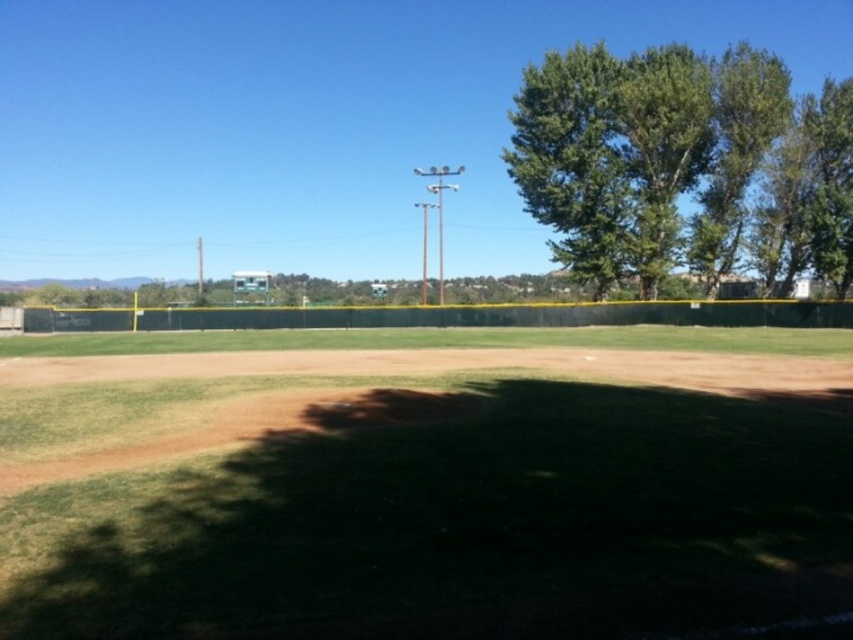
You are a groundskeeper planning to mow the green grass at center and trim the green leafy tree at upper right. Based on their widths, which task requires more attention to detail?

The green grass at center has a smaller width than the green leafy tree at upper right, so trimming the green leafy tree at upper right may require more attention to detail due to its larger size.

You are a photographer standing at the edge of the baseball field. You want to take a photo that includes both the point at coordinates point(x=309, y=604) and point(x=674, y=166). Which point will appear larger in the photo?

Point(x=309, y=604) will appear larger in the photo because it is closer to the camera than point(x=674, y=166).

Based on the photo, you are a groundskeeper checking the baseball field. You need to water the green grass at center and the green leafy tree at upper right. Which object is closer to the fence that runs along the background?

The green grass at center is closer to the fence that runs along the background because it is located below the green leafy tree at upper right, placing it nearer to the fence in the background.